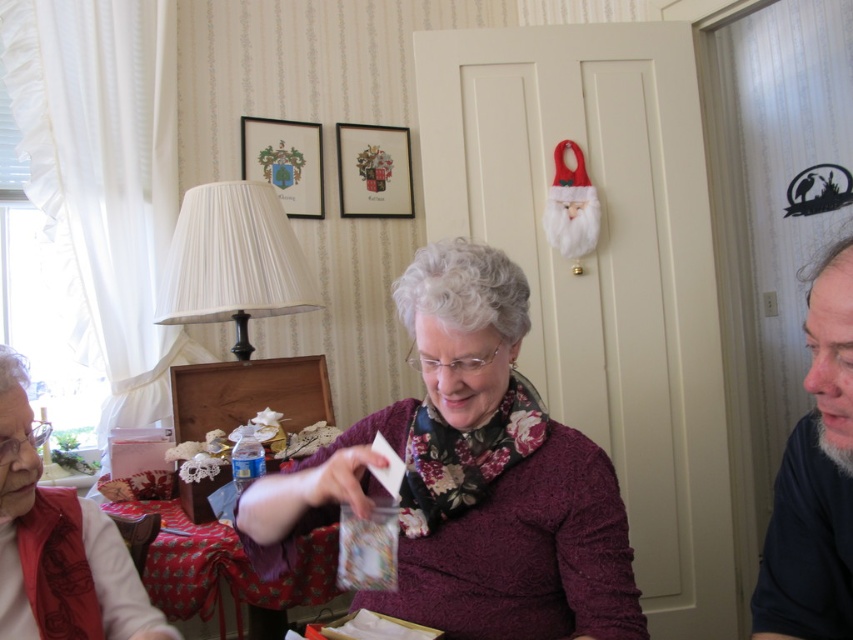
You are a fashion designer observing the scene and need to determine the spatial relationship between the purple textured sweater at center and the red fabric tablecloth at lower center. Based on their positions, which object appears taller?

The purple textured sweater at center is taller than the red fabric tablecloth at lower center according to the description.

You are a delivery person standing 40 inches away from the purple textured sweater at center. Can you reach it without moving closer?

The purple textured sweater at center is 36.41 inches away from the viewer. Since you are standing 40 inches away, you are farther than the sweater, so you cannot reach it without moving closer.

You are standing in the living room and see the purple textured sweater at center. Where exactly is it located in terms of coordinates?

The purple textured sweater at center is located at coordinates point (469, 477).